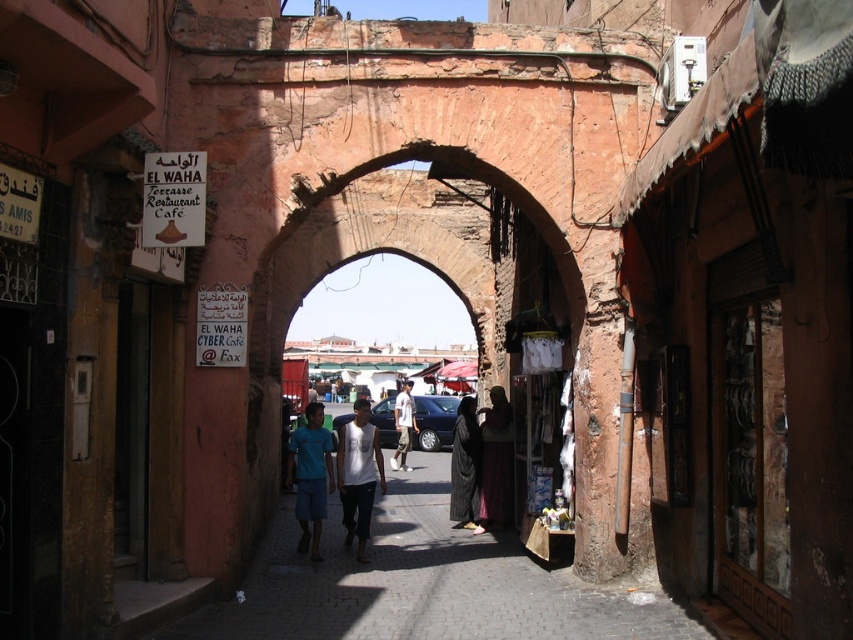
Question: Is blue cotton shirt at center further to camera compared to light brown cotton shirt at center?

Choices:
 (A) yes
 (B) no

Answer: (B)

Question: Among these objects, which one is nearest to the camera?

Choices:
 (A) dark purple fabric at center
 (B) rustic stone archway at center
 (C) light brown cotton shirt at center
 (D) smooth stone pavement at center

Answer: (D)

Question: Is rustic stone archway at center positioned behind light brown cotton shirt at center?

Choices:
 (A) yes
 (B) no

Answer: (B)

Question: Among these points, which one is nearest to the camera?

Choices:
 (A) (453, 452)
 (B) (320, 412)
 (C) (395, 456)

Answer: (B)

Question: Does dark purple fabric at center appear on the right side of light brown cotton shirt at center?

Choices:
 (A) yes
 (B) no

Answer: (A)

Question: Which object is positioned farthest from the rustic stone archway at center?

Choices:
 (A) dark purple fabric at center
 (B) white cotton shirt at center

Answer: (A)